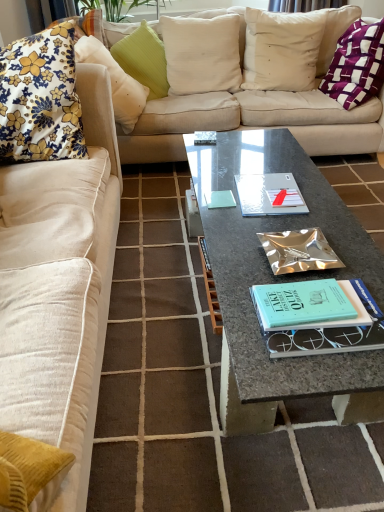
Identify the location of vacant space behind metallic silver book at center. (287, 219).